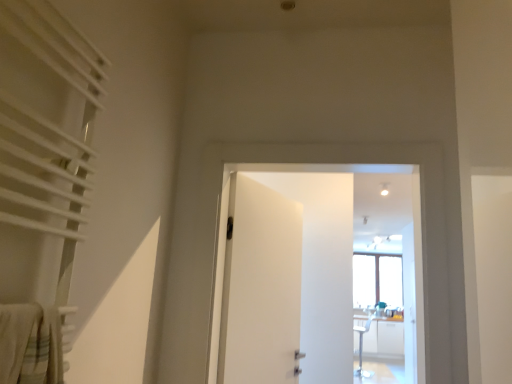
Question: Does white textured curtain at left come behind white matte door at center, positioned as the second door in right-to-left order?

Choices:
 (A) no
 (B) yes

Answer: (A)

Question: Is white textured curtain at left oriented away from white matte door at center, positioned as the second door in right-to-left order?

Choices:
 (A) no
 (B) yes

Answer: (A)

Question: Can you confirm if white textured curtain at left is positioned to the right of white matte door at center, which ranks as the 1th door in left-to-right order?

Choices:
 (A) yes
 (B) no

Answer: (B)

Question: From a real-world perspective, is white textured curtain at left on white matte door at center, positioned as the second door in right-to-left order?

Choices:
 (A) yes
 (B) no

Answer: (A)

Question: Considering the relative sizes of white textured curtain at left and white matte door at center, positioned as the second door in right-to-left order, in the image provided, is white textured curtain at left smaller than white matte door at center, positioned as the second door in right-to-left order,?

Choices:
 (A) no
 (B) yes

Answer: (A)

Question: Considering the relative positions of white textured curtain at left and white matte door at center, positioned as the second door in right-to-left order, in the image provided, is white textured curtain at left to the left of white matte door at center, positioned as the second door in right-to-left order, from the viewer's perspective?

Choices:
 (A) no
 (B) yes

Answer: (B)

Question: Could you tell me if white matte door at center, the 2th door from the left, is facing white textured curtain at left?

Choices:
 (A) no
 (B) yes

Answer: (B)

Question: Considering the relative sizes of white matte door at center, placed as the 1th door when sorted from right to left, and white textured curtain at left in the image provided, is white matte door at center, placed as the 1th door when sorted from right to left, shorter than white textured curtain at left?

Choices:
 (A) yes
 (B) no

Answer: (B)

Question: Can you confirm if white matte door at center, placed as the 1th door when sorted from right to left, is wider than white textured curtain at left?

Choices:
 (A) no
 (B) yes

Answer: (B)

Question: Is white matte door at center, the 2th door from the left, outside of white textured curtain at left?

Choices:
 (A) yes
 (B) no

Answer: (A)

Question: Would you consider white matte door at center, placed as the 1th door when sorted from right to left, to be distant from white textured curtain at left?

Choices:
 (A) no
 (B) yes

Answer: (A)

Question: From the image's perspective, is white matte door at center, placed as the 1th door when sorted from right to left, beneath white textured curtain at left?

Choices:
 (A) no
 (B) yes

Answer: (B)

Question: Can you confirm if white matte door at center, which ranks as the 1th door in left-to-right order, is thinner than white matte door at center, placed as the 1th door when sorted from right to left?

Choices:
 (A) yes
 (B) no

Answer: (A)